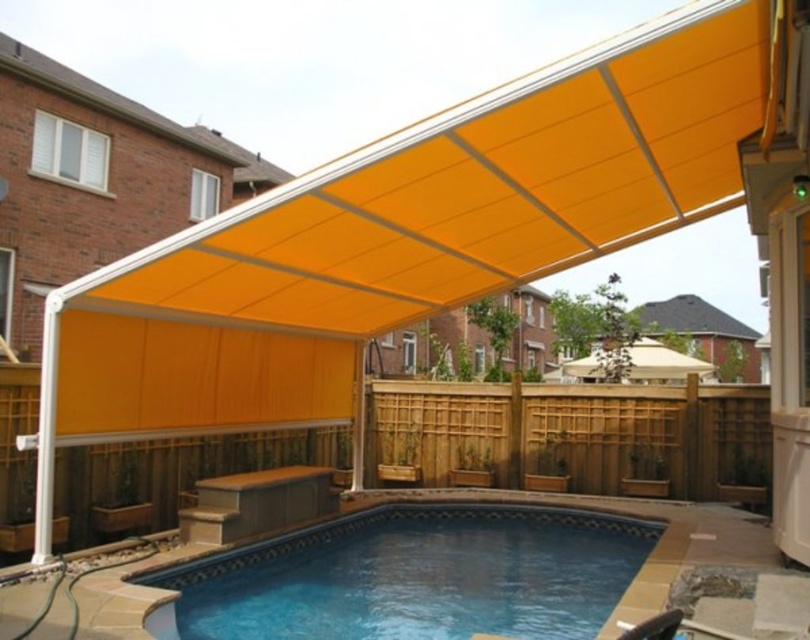
You are planning to host a pool party and want to ensure there is enough space for guests under the orange fabric awning at center. Given that the blue tile swimming pool at center is smaller in area, can you estimate if there is sufficient shaded area under the awning for people to gather without being in the pool?

The blue tile swimming pool at center occupies less space than the orange fabric awning at center, meaning the awning covers a larger area. This suggests there is enough shaded space under the orange fabric awning at center for guests to gather outside of the pool area.

You are standing at the entrance of the backyard and want to head towards the blue tile swimming pool at center. Based on the coordinates provided, in which general direction should you walk from your current position?

The blue tile swimming pool at center is located at point 0.900 on the x and 0.516 on the y axis. Since you are at the entrance, which is likely at the lower left corner of the image, you should walk towards the right and slightly forward to reach the pool.

You are planning to install a new lighting system for the blue tile swimming pool at center and the orange fabric awning at center. Since the height difference between them is crucial for the installation, which object is shorter?

The blue tile swimming pool at center is shorter than the orange fabric awning at center.